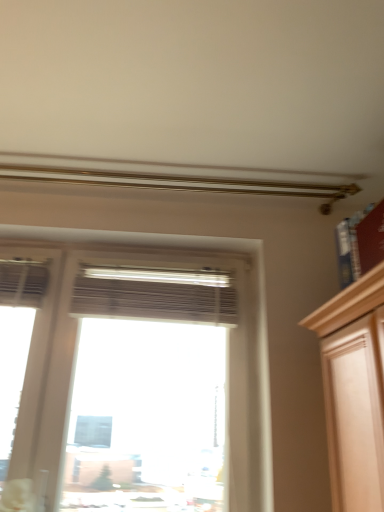
What do you see at coordinates (147, 318) in the screenshot? Image resolution: width=384 pixels, height=512 pixels. I see `white matte window frame at center` at bounding box center [147, 318].

The width and height of the screenshot is (384, 512). I want to click on white matte window frame at center, so click(147, 318).

You are a GUI agent. You are given a task and a screenshot of the screen. Output one action in this format:
    pyautogui.click(x=<x>, y=<y>)
    Task: Click on the white matte window frame at center
    
    Given the screenshot: What is the action you would take?
    pyautogui.click(x=147, y=318)